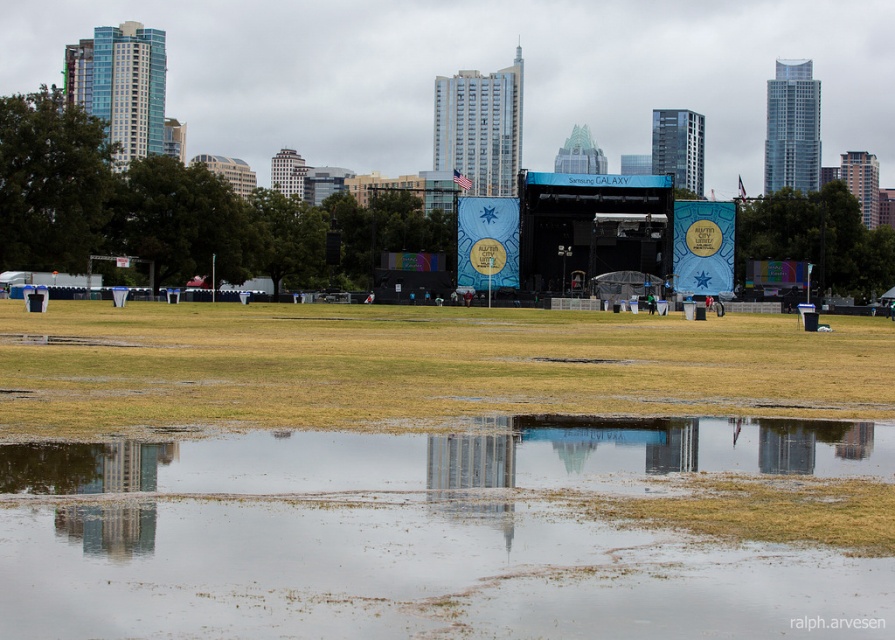
Question: Which point appears closest to the camera in this image?

Choices:
 (A) (420, 572)
 (B) (527, 406)

Answer: (A)

Question: Does transparent water at lower center appear over brown grass at lower center?

Choices:
 (A) no
 (B) yes

Answer: (A)

Question: Is transparent water at lower center further to camera compared to brown grass at lower center?

Choices:
 (A) no
 (B) yes

Answer: (A)

Question: Among these points, which one is farthest from the camera?

Choices:
 (A) (503, 483)
 (B) (243, 381)

Answer: (B)

Question: Where is transparent water at lower center located in relation to brown grass at lower center in the image?

Choices:
 (A) left
 (B) right

Answer: (A)

Question: Which of the following is the closest to the observer?

Choices:
 (A) coord(540,355)
 (B) coord(265,481)

Answer: (B)